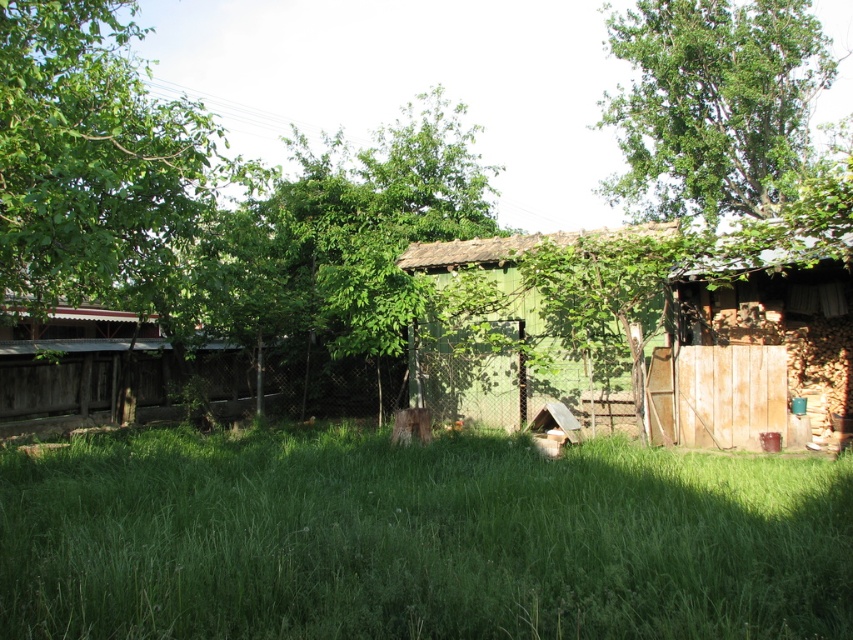
Where is `green leafy tree at upper right`? green leafy tree at upper right is located at coordinates (712, 104).

Does point (770, 113) come in front of point (741, 298)?

No, it is not.

Where is `green leafy tree at upper right`? green leafy tree at upper right is located at coordinates (712, 104).

Looking at this image, who is shorter, green wooden hut at center or wooden shed at right?

Standing shorter between the two is green wooden hut at center.

Between green wooden hut at center and wooden shed at right, which one appears on the left side from the viewer's perspective?

Positioned to the left is green wooden hut at center.

Which is behind, point (427, 244) or point (746, 289)?

Point (427, 244)

In order to click on green wooden hut at center in this screenshot , I will do `click(561, 296)`.

Is green grassy at center thinner than green leafy tree at center?

Yes, green grassy at center is thinner than green leafy tree at center.

Looking at this image, is green grassy at center shorter than green leafy tree at center?

Yes.

Who is more distant from viewer, (267, 547) or (178, 304)?

The point (178, 304) is behind.

In order to click on green grassy at center in this screenshot , I will do `click(418, 540)`.